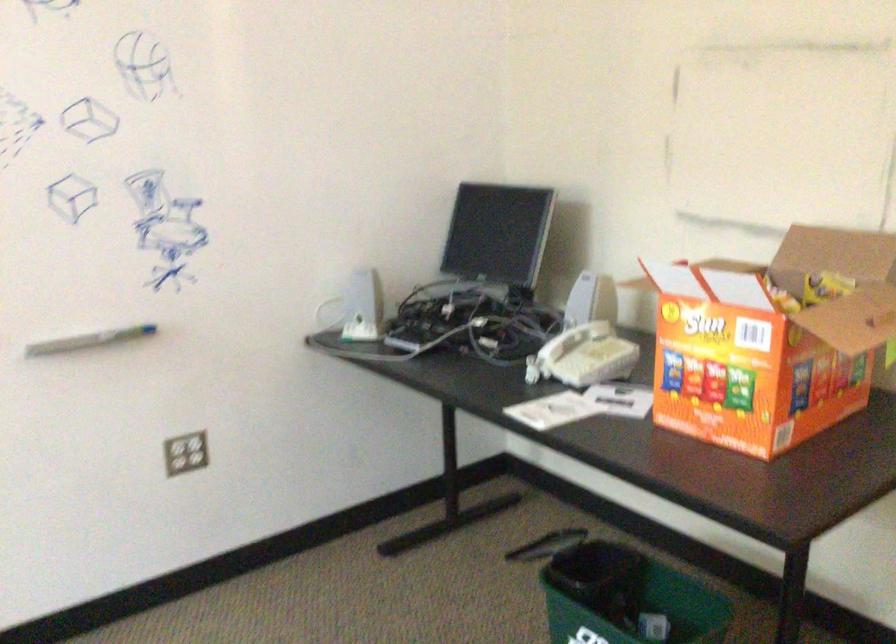
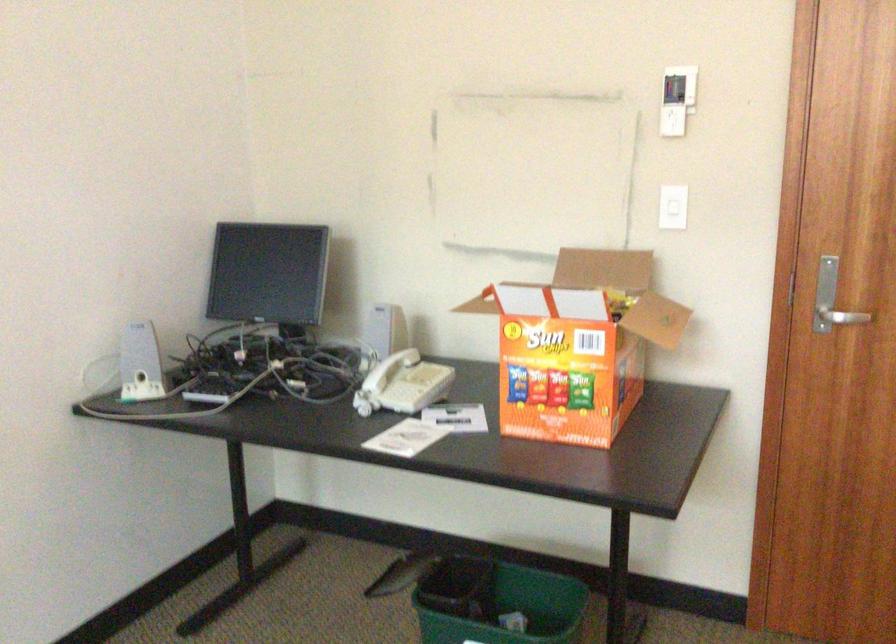
Locate, in the second image, the point that corresponds to pixel 744 330 in the first image.

(578, 345)